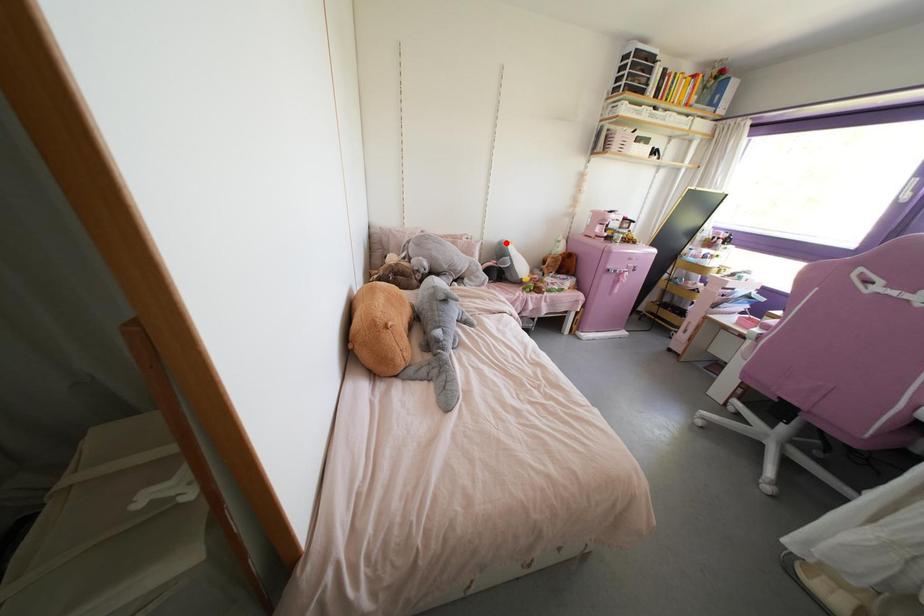
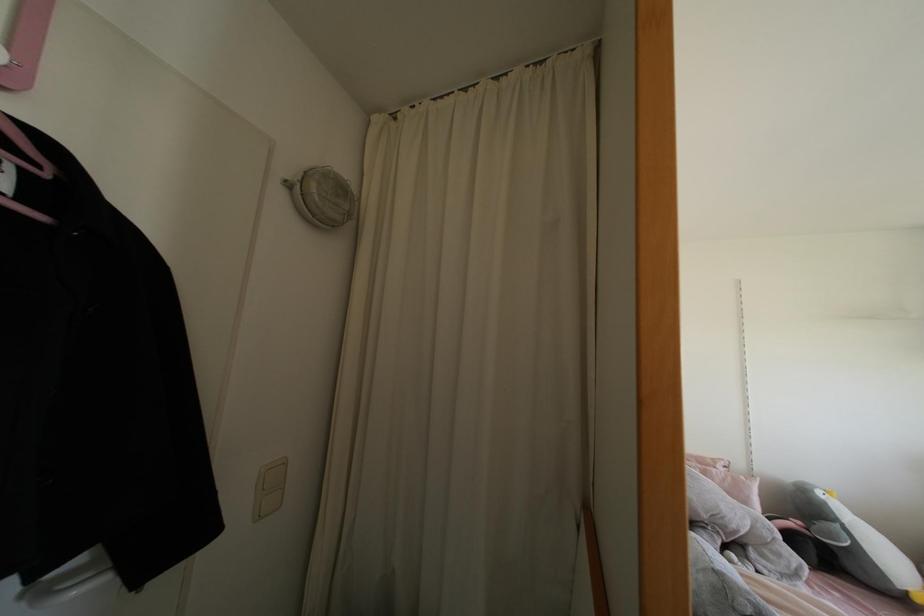
Find the pixel in the second image that matches the highlighted location in the first image.

(819, 493)